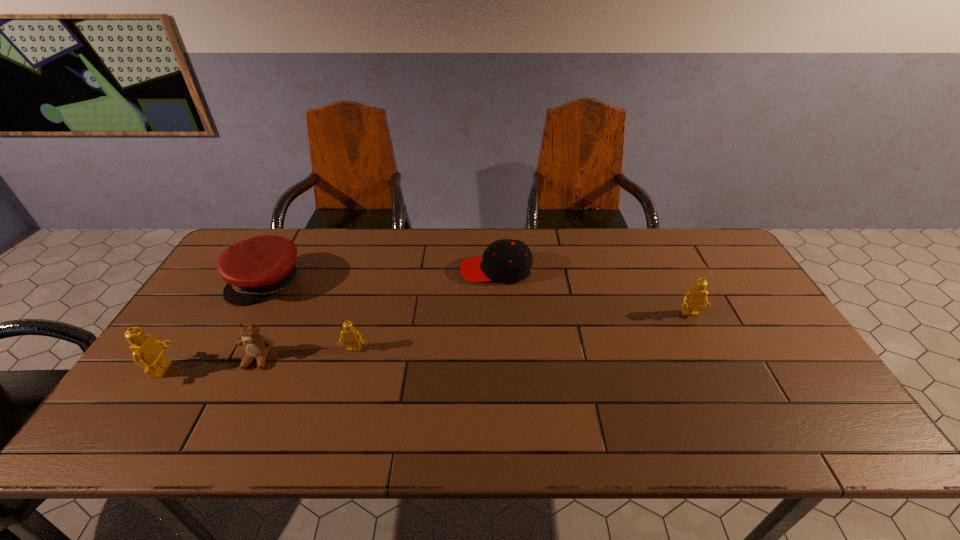
Where is `the tallest object`? the tallest object is located at coordinates (147, 351).

The image size is (960, 540). What are the coordinates of `the tallest Lego` in the screenshot? It's located at (147, 351).

What are the coordinates of `the shortest Lego` in the screenshot? It's located at (352, 338).

Locate an element on the screen. Image resolution: width=960 pixels, height=540 pixels. the second Lego from right to left is located at coordinates (352, 338).

The height and width of the screenshot is (540, 960). I want to click on the farthest Lego, so click(693, 300).

Identify the location of the rightmost Lego. (693, 300).

Locate an element on the screen. Image resolution: width=960 pixels, height=540 pixels. the second object from right to left is located at coordinates (506, 260).

Find the location of a particular element. This screenshot has height=540, width=960. the left cap is located at coordinates (255, 268).

Locate an element on the screen. teddy bear is located at coordinates (256, 346).

Find the location of a particular element. The height and width of the screenshot is (540, 960). vacant space located 0.390m on the face of the leftmost Lego is located at coordinates (328, 370).